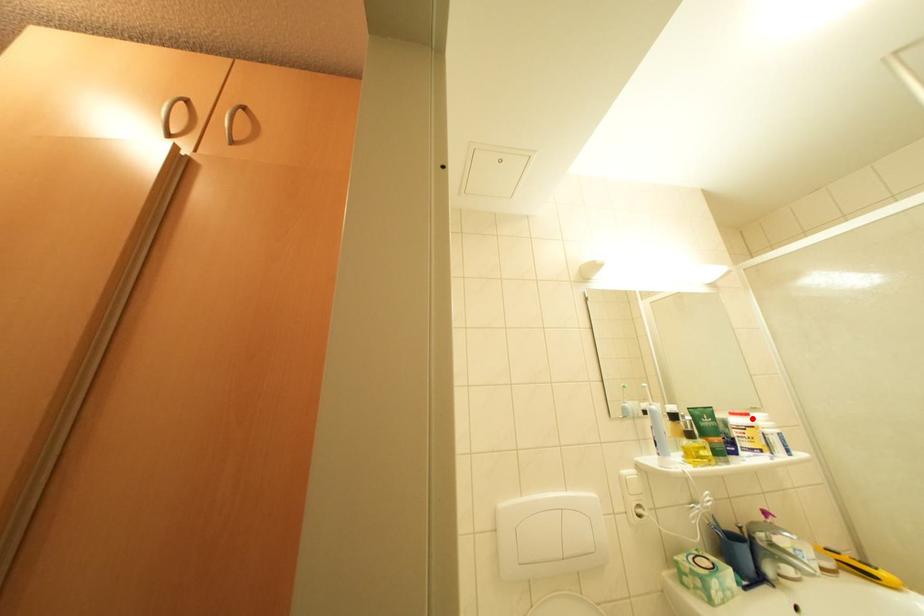
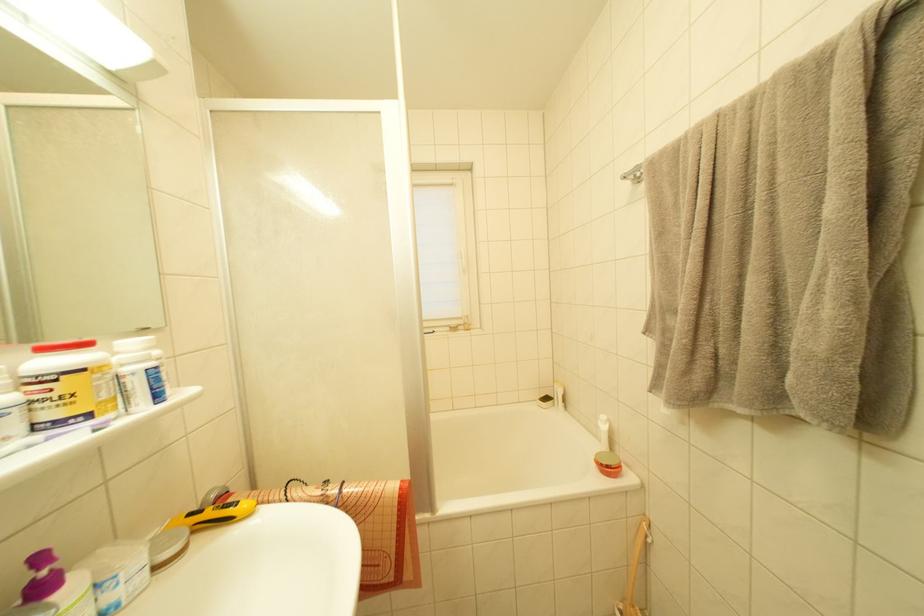
Question: I am providing you with two images of the same scene from different viewpoints. A red point is marked on the first image. At the location where the point appears in image 1, is it still visible in image 2?

Choices:
 (A) Yes
 (B) No

Answer: (A)